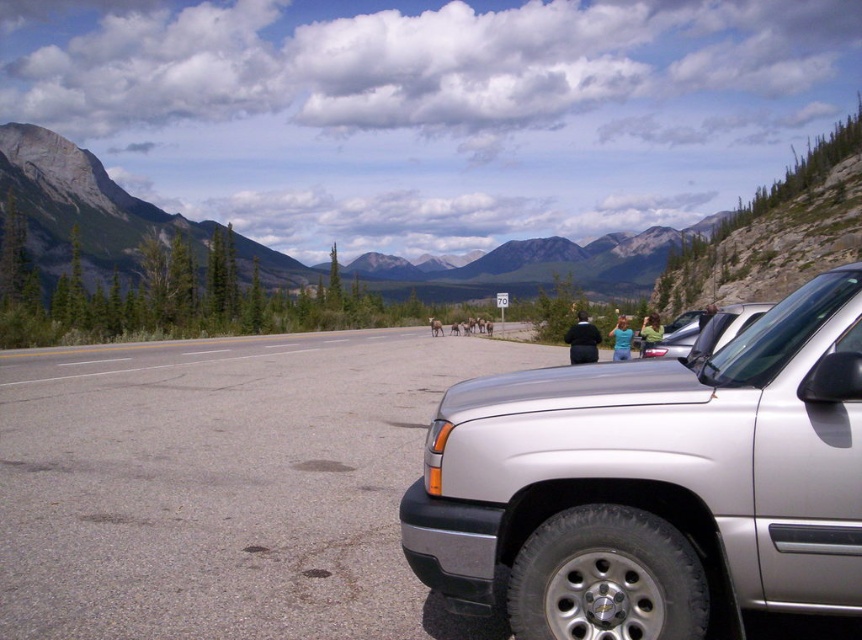
You are a photographer trying to capture the silver metallic jeep at center and the gray rock mountain at upper left in a single shot. Based on their positions, which object will appear larger in your photo?

The silver metallic jeep at center will appear larger in the photo because it is closer to the viewer than the gray rock mountain at upper left.

You are a hiker who needs to reach the gray rock mountain at upper left from the silver metallic jeep at center. Given that you can walk at 5 km per hour, how long will it take you to reach the mountain?

The silver metallic jeep at center and gray rock mountain at upper left are 108.52 meters apart from each other. Converting meters to kilometers, 108.52 meters is 0.10852 kilometers. At a walking speed of 5 km per hour, the time required is 0.10852 km divided by 5 km per hour, which equals approximately 0.0217 hours. Converting hours to minutes by multiplying by 60, this results in roughly 1.3 minutes. Therefore, it will take about 1 minute and 18 seconds to reach the gray rock mountain at upper left from.

You are standing at the point with coordinates point (654, 484). What object are you standing on?

The point (654, 484) corresponds to the silver metallic jeep at center, so you are standing on the silver metallic jeep at center.